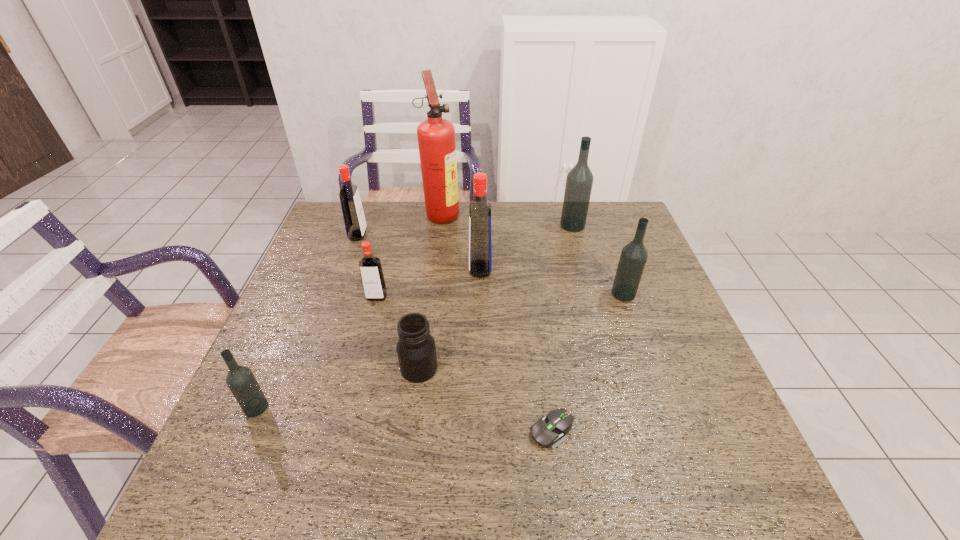
Find the location of a particular element. vacant space situated 0.200m on the front and back of the biggest red vodka is located at coordinates (400, 268).

This screenshot has height=540, width=960. I want to click on vacant position located 0.080m on the front and back of the biggest red vodka, so click(x=442, y=268).

Locate an element on the screen. The image size is (960, 540). vacant space located 0.150m on the front and back of the biggest red vodka is located at coordinates (418, 268).

Locate an element on the screen. The height and width of the screenshot is (540, 960). free region located on the front and back of the leftmost red vodka is located at coordinates (466, 235).

Find the location of `vacant area situated 0.190m on the back of the rightmost vodka`. vacant area situated 0.190m on the back of the rightmost vodka is located at coordinates (606, 245).

You are a GUI agent. You are given a task and a screenshot of the screen. Output one action in this format:
    pyautogui.click(x=<x>, y=<y>)
    Task: Click on the vacant area situated on the front and back of the third object from left to right
    
    Given the screenshot: What is the action you would take?
    [348, 411]

Find the location of `vacant point located on the front of the nearest black vodka`. vacant point located on the front of the nearest black vodka is located at coordinates (233, 459).

Where is `free space located on the right of the third nearest object`? This screenshot has height=540, width=960. free space located on the right of the third nearest object is located at coordinates (524, 368).

At what (x,y) coordinates should I click in order to perform the action: click on free region located on the left of the third object from right to left. Please return your answer as a coordinate pair (x, y). The width and height of the screenshot is (960, 540). Looking at the image, I should click on (382, 430).

The height and width of the screenshot is (540, 960). In order to click on fire extinguisher present at the far edge in this screenshot , I will do `click(436, 136)`.